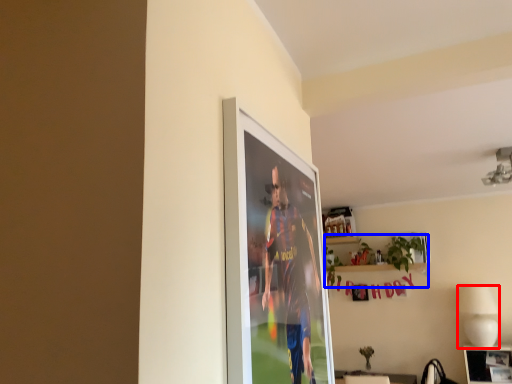
Question: Which object is closer to the camera taking this photo, lamp (highlighted by a red box) or houseplant (highlighted by a blue box)?

Choices:
 (A) lamp
 (B) houseplant

Answer: (A)